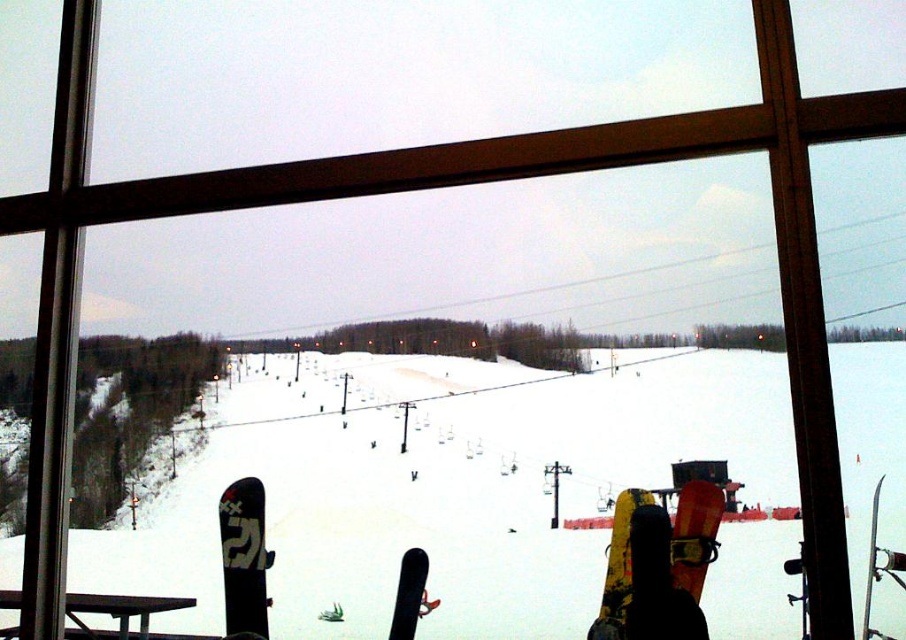
Question: Is matte orange snowboard at lower right to the left of shiny metallic ski at lower right from the viewer's perspective?

Choices:
 (A) yes
 (B) no

Answer: (A)

Question: Which of the following is the farthest from the observer?

Choices:
 (A) (413, 584)
 (B) (871, 548)
 (C) (347, 429)

Answer: (C)

Question: In this image, where is yellow matte snowboard at center located relative to shiny metallic ski at lower right?

Choices:
 (A) above
 (B) below

Answer: (B)

Question: Considering the relative positions of yellow matte snowboard at lower center and matte black snowboard at lower left in the image provided, where is yellow matte snowboard at lower center located with respect to matte black snowboard at lower left?

Choices:
 (A) left
 (B) right

Answer: (B)

Question: Which object is positioned farthest from the matte black snowboard at lower left?

Choices:
 (A) shiny metallic ski at lower right
 (B) yellow matte snowboard at lower center
 (C) brown wooden picnic table at lower left

Answer: (A)

Question: Considering the real-world distances, which object is closest to the white matte snow at center?

Choices:
 (A) black matte snowboard at center
 (B) matte orange snowboard at lower right
 (C) yellow matte snowboard at lower center

Answer: (C)